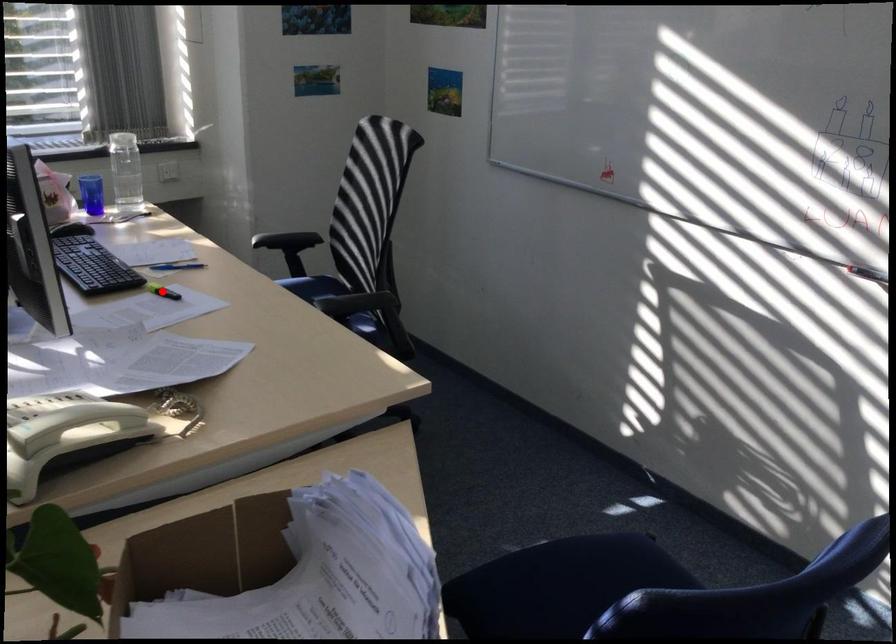
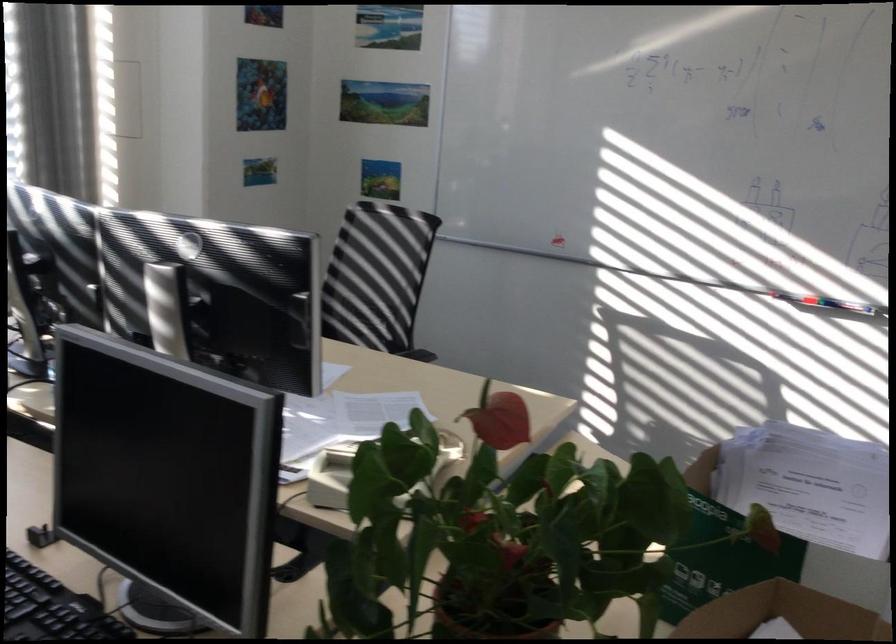
Question: I am providing you with two images of the same scene from different viewpoints. A red point is marked on the first image. Can you still see the location of the red point in image 2?

Choices:
 (A) Yes
 (B) No

Answer: (B)